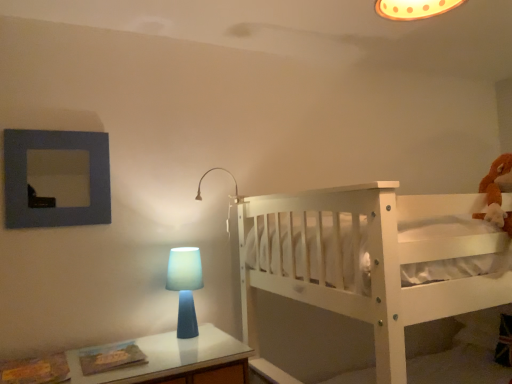
Measure the distance between point [325,283] and camera.

The depth of point [325,283] is 4.87 feet.

At what (x,y) coordinates should I click in order to perform the action: click on blue matte picture frame at upper left. Please return your answer as a coordinate pair (x, y). The image size is (512, 384). Looking at the image, I should click on (56, 178).

What do you see at coordinates (185, 287) in the screenshot? Image resolution: width=512 pixels, height=384 pixels. I see `blue matte table lamp at center` at bounding box center [185, 287].

Identify the location of blue matte table lamp at center. The image size is (512, 384). (185, 287).

You are a GUI agent. You are given a task and a screenshot of the screen. Output one action in this format:
    pyautogui.click(x=<x>, y=<y>)
    Task: Click on the matte white lamp at upper center
    Image resolution: width=512 pixels, height=384 pixels.
    Given the screenshot: What is the action you would take?
    pyautogui.click(x=209, y=172)

Locate an element on the screen. The width and height of the screenshot is (512, 384). white wooden bunk bed at right is located at coordinates (367, 260).

What's the angular difference between matte white lamp at upper center and white wooden bunk bed at right's facing directions?

The angle between the facing direction of matte white lamp at upper center and the facing direction of white wooden bunk bed at right is 0.000659 degrees.

In the scene shown: Are matte white lamp at upper center and white wooden bunk bed at right far apart?

No, there isn't a large distance between matte white lamp at upper center and white wooden bunk bed at right.

Is matte white lamp at upper center taller or shorter than white wooden bunk bed at right?

Considering their sizes, matte white lamp at upper center has less height than white wooden bunk bed at right.

Between white wooden bunk bed at right and blue matte table lamp at center, which one has larger size?

white wooden bunk bed at right.

Which is behind, point (393, 341) or point (181, 270)?

The point (181, 270) is behind.

From the image's perspective, who appears lower, white wooden bunk bed at right or blue matte table lamp at center?

white wooden bunk bed at right.

In the image, there is a blue matte table lamp at center. Identify the location of infant bed below it (from the image's perspective). This screenshot has height=384, width=512. (367, 260).

Is white wooden bunk bed at right further to camera compared to matte white lamp at upper center?

No.

Is white wooden bunk bed at right bigger or smaller than matte white lamp at upper center?

white wooden bunk bed at right is bigger than matte white lamp at upper center.

From a real-world perspective, is white wooden bunk bed at right positioned under matte white lamp at upper center based on gravity?

Indeed, from a real-world perspective, white wooden bunk bed at right is positioned beneath matte white lamp at upper center.

In the scene shown: Which is behind, blue matte picture frame at upper left or matte white lamp at upper center?

matte white lamp at upper center is more distant.

Based on the photo, which point is more forward, (58, 173) or (197, 196)?

The point (58, 173) is closer to the camera.

Considering the positions of objects blue matte picture frame at upper left and matte white lamp at upper center in the image provided, who is more to the left, blue matte picture frame at upper left or matte white lamp at upper center?

blue matte picture frame at upper left is more to the left.

From the image's perspective, which is below, blue matte picture frame at upper left or matte white lamp at upper center?

matte white lamp at upper center is shown below in the image.

Looking at this image, from a real-world perspective, is blue matte picture frame at upper left over white wooden bunk bed at right?

Indeed, from a real-world perspective, blue matte picture frame at upper left stands above white wooden bunk bed at right.

Find the location of a particular element. picture frame above the white wooden bunk bed at right (from a real-world perspective) is located at coordinates (56, 178).

How different are the orientations of blue matte picture frame at upper left and white wooden bunk bed at right in degrees?

There is a 90-degree angle between the facing directions of blue matte picture frame at upper left and white wooden bunk bed at right.

From the image's perspective, is blue matte picture frame at upper left located beneath white wooden bunk bed at right?

Incorrect, from the image's perspective, blue matte picture frame at upper left is higher than white wooden bunk bed at right.

How different are the orientations of white wooden bunk bed at right and blue matte picture frame at upper left in degrees?

90 degrees.

Which is more to the left, white wooden bunk bed at right or blue matte picture frame at upper left?

Positioned to the left is blue matte picture frame at upper left.

Can you confirm if white wooden bunk bed at right is shorter than blue matte picture frame at upper left?

No.

Is white wooden bunk bed at right thinner than blue matte picture frame at upper left?

No, white wooden bunk bed at right is not thinner than blue matte picture frame at upper left.

From the image's perspective, is blue matte table lamp at center below matte white lamp at upper center?

Yes.

Considering the points (190, 256) and (230, 174), which point is behind, point (190, 256) or point (230, 174)?

The point (230, 174) is farther.

What's the angular difference between blue matte table lamp at center and matte white lamp at upper center's facing directions?

The angle between the facing direction of blue matte table lamp at center and the facing direction of matte white lamp at upper center is 90 degrees.

Considering the sizes of objects blue matte table lamp at center and matte white lamp at upper center in the image provided, who is smaller, blue matte table lamp at center or matte white lamp at upper center?

matte white lamp at upper center.

Where is `lamp that is above the white wooden bunk bed at right (from the image's perspective)`? Image resolution: width=512 pixels, height=384 pixels. lamp that is above the white wooden bunk bed at right (from the image's perspective) is located at coordinates (209, 172).

At what (x,y) coordinates should I click in order to perform the action: click on infant bed below the blue matte table lamp at center (from a real-world perspective). Please return your answer as a coordinate pair (x, y). Looking at the image, I should click on (367, 260).

Estimate the real-world distances between objects in this image. Which object is further from matte white lamp at upper center, blue matte table lamp at center or white wooden bunk bed at right?

white wooden bunk bed at right lies further to matte white lamp at upper center than the other object.

From the image, which object appears to be farther from blue matte picture frame at upper left, matte white lamp at upper center or blue matte table lamp at center?

matte white lamp at upper center.

Looking at the image, which one is located further to blue matte table lamp at center, white wooden bunk bed at right or matte white lamp at upper center?

The object further to blue matte table lamp at center is white wooden bunk bed at right.

When comparing their distances from matte white lamp at upper center, does blue matte picture frame at upper left or white wooden bunk bed at right seem further?

The object further to matte white lamp at upper center is white wooden bunk bed at right.

Based on their spatial positions, is white wooden bunk bed at right or blue matte table lamp at center further from blue matte picture frame at upper left?

Among the two, white wooden bunk bed at right is located further to blue matte picture frame at upper left.

From the image, which object appears to be nearer to blue matte table lamp at center, blue matte picture frame at upper left or white wooden bunk bed at right?

blue matte picture frame at upper left lies closer to blue matte table lamp at center than the other object.

Looking at the image, which one is located further to white wooden bunk bed at right, blue matte picture frame at upper left or blue matte table lamp at center?

blue matte picture frame at upper left is positioned further to the anchor white wooden bunk bed at right.

Based on the photo, from the image, which object appears to be nearer to blue matte table lamp at center, matte white lamp at upper center or blue matte picture frame at upper left?

The object closer to blue matte table lamp at center is matte white lamp at upper center.

I want to click on lamp situated between blue matte table lamp at center and white wooden bunk bed at right from left to right, so click(x=209, y=172).

This screenshot has width=512, height=384. In order to click on lamp between blue matte picture frame at upper left and white wooden bunk bed at right from left to right in this screenshot , I will do `click(209, 172)`.

Find the location of a particular element. The image size is (512, 384). table lamp between blue matte picture frame at upper left and matte white lamp at upper center in the horizontal direction is located at coordinates (185, 287).

Where is `table lamp between blue matte picture frame at upper left and white wooden bunk bed at right in the horizontal direction`? table lamp between blue matte picture frame at upper left and white wooden bunk bed at right in the horizontal direction is located at coordinates (185, 287).